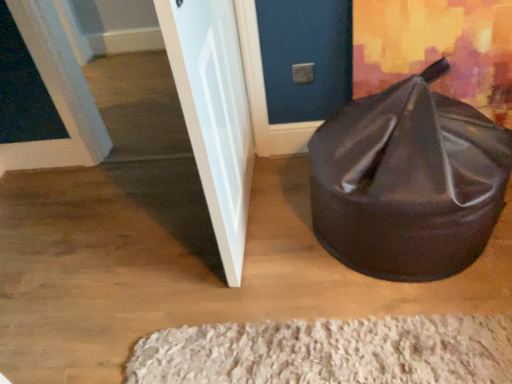
Question: In terms of size, does white painted wood door at upper left, which appears as the second door when viewed from the right, appear bigger or smaller than black leather bean bag at lower right?

Choices:
 (A) small
 (B) big

Answer: (A)

Question: From their relative heights in the image, would you say white painted wood door at upper left, which ranks as the first door in left-to-right order, is taller or shorter than black leather bean bag at lower right?

Choices:
 (A) tall
 (B) short

Answer: (A)

Question: Estimate the real-world distances between objects in this image. Which object is closer to the white glossy door at left, the second door from the left?

Choices:
 (A) white painted wood door at upper left, which appears as the second door when viewed from the right
 (B) black leather bean bag at lower right
 (C) white shaggy rug at lower center

Answer: (B)

Question: Which object is the farthest from the white shaggy rug at lower center?

Choices:
 (A) white glossy door at left, the second door from the left
 (B) white painted wood door at upper left, which ranks as the first door in left-to-right order
 (C) black leather bean bag at lower right

Answer: (B)